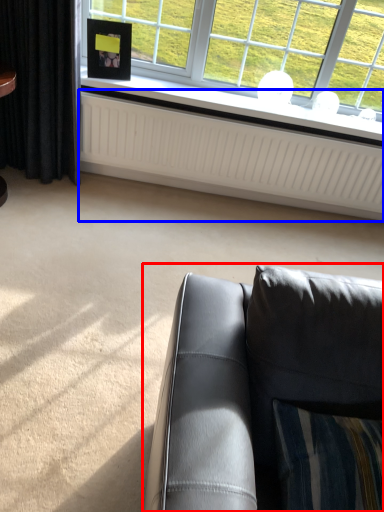
Question: Which of the following is the farthest to the observer, studio couch (highlighted by a red box) or radiator (highlighted by a blue box)?

Choices:
 (A) studio couch
 (B) radiator

Answer: (B)